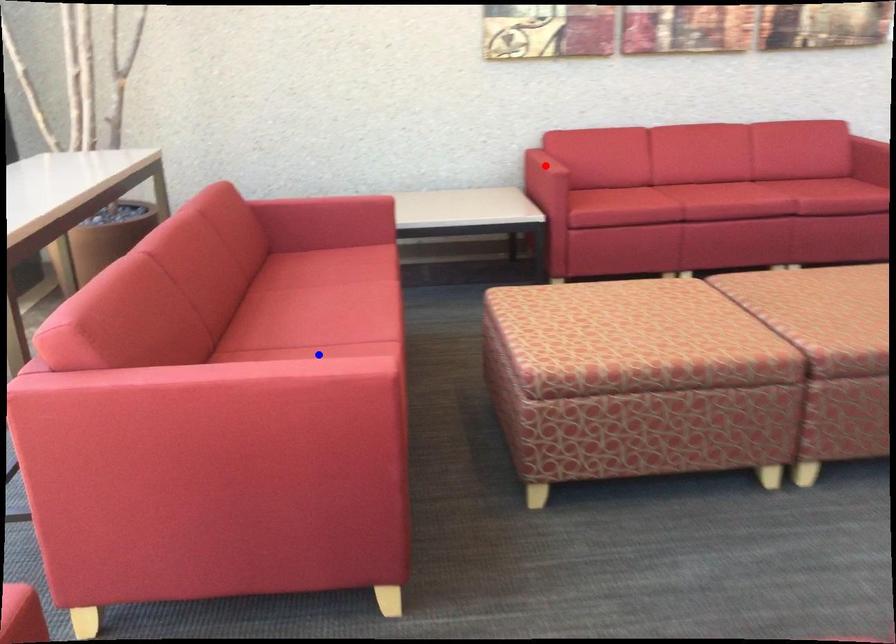
Question: In the image, two points are highlighted. Which point is nearer to the camera? Reply with the corresponding letter.

Choices:
 (A) blue point
 (B) red point

Answer: (A)